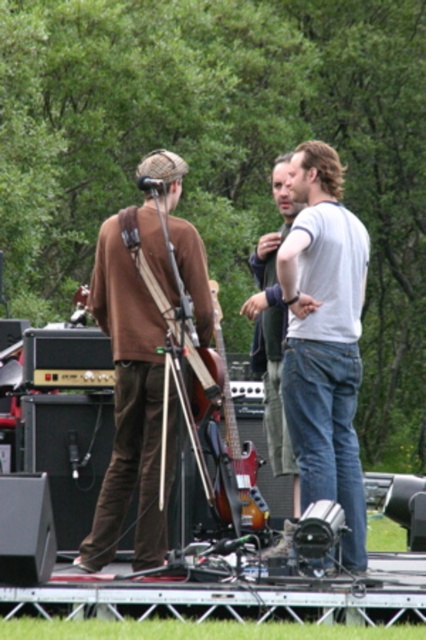
Who is lower down, white cotton t-shirt at center or sunburst wood electric guitar at center?

Positioned lower is sunburst wood electric guitar at center.

Is white cotton t-shirt at center taller than sunburst wood electric guitar at center?

Correct, white cotton t-shirt at center is much taller as sunburst wood electric guitar at center.

Image resolution: width=426 pixels, height=640 pixels. What are the coordinates of `white cotton t-shirt at center` in the screenshot? It's located at click(x=325, y=339).

Who is more distant from viewer, [206,304] or [259,518]?

Point [259,518]

Can you confirm if brown suede shirt at left is positioned to the left of sunburst wood electric guitar at center?

Indeed, brown suede shirt at left is positioned on the left side of sunburst wood electric guitar at center.

The width and height of the screenshot is (426, 640). Describe the element at coordinates (129, 406) in the screenshot. I see `brown suede shirt at left` at that location.

Find the location of `brown suede shirt at left`. brown suede shirt at left is located at coordinates (129, 406).

Based on the photo, does brown cotton shirt at center appear on the left side of white cotton t-shirt at center?

No, brown cotton shirt at center is not to the left of white cotton t-shirt at center.

Which of these two, brown cotton shirt at center or white cotton t-shirt at center, stands taller?

brown cotton shirt at center

The width and height of the screenshot is (426, 640). What do you see at coordinates (328, 433) in the screenshot?
I see `brown cotton shirt at center` at bounding box center [328, 433].

Locate an element on the screen. This screenshot has width=426, height=640. brown cotton shirt at center is located at coordinates (328, 433).